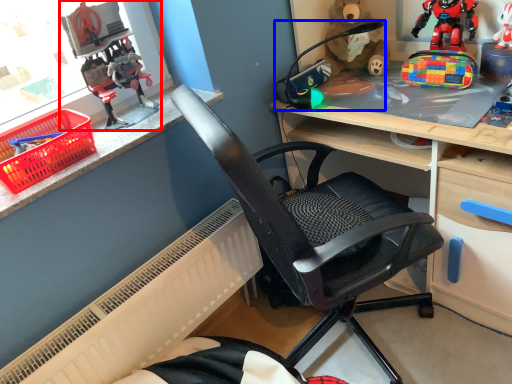
Question: Which object is closer to the camera taking this photo, toy (highlighted by a red box) or toy (highlighted by a blue box)?

Choices:
 (A) toy
 (B) toy

Answer: (A)